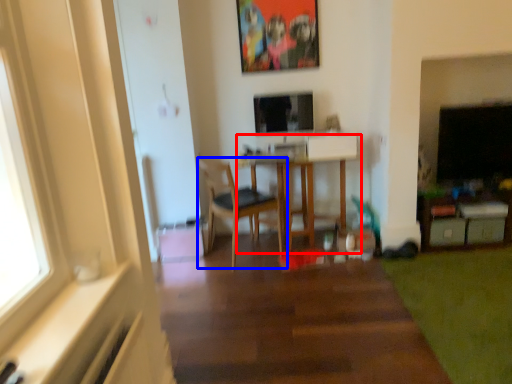
Question: Which object is closer to the camera taking this photo, table (highlighted by a red box) or chair (highlighted by a blue box)?

Choices:
 (A) table
 (B) chair

Answer: (B)